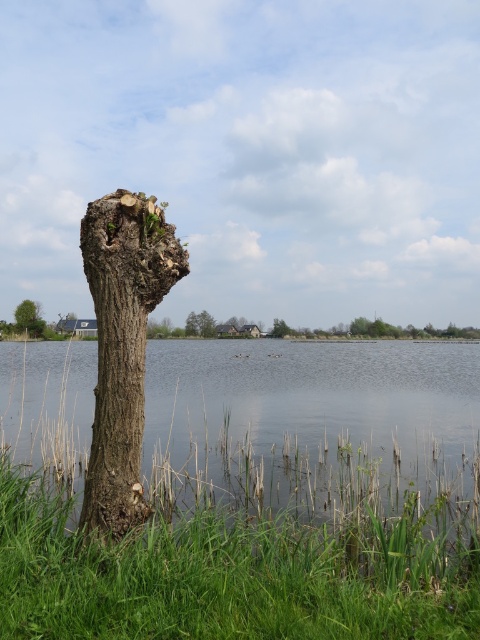
Is green grass at lower left positioned at the back of green rough bark tree at left?

No, it is not.

Is point (213, 522) more distant than point (24, 324)?

No, it is in front of (24, 324).

I want to click on green grass at lower left, so click(230, 576).

Is green grass at lower left above smooth bark tree trunk at center?

No, green grass at lower left is not above smooth bark tree trunk at center.

Who is more distant from viewer, (444, 634) or (286, 324)?

The point (286, 324) is more distant.

What do you see at coordinates (230, 576) in the screenshot? I see `green grass at lower left` at bounding box center [230, 576].

Identify the location of green grass at lower left. The width and height of the screenshot is (480, 640). (230, 576).

Is clear water at center wider than green rough bark tree at left?

Yes, clear water at center is wider than green rough bark tree at left.

Image resolution: width=480 pixels, height=640 pixels. Find the location of `clear water at center`. clear water at center is located at coordinates (313, 426).

Does point (312, 467) lie behind point (16, 321)?

No, it is in front of (16, 321).

Identify the location of clear water at center. Image resolution: width=480 pixels, height=640 pixels. (313, 426).